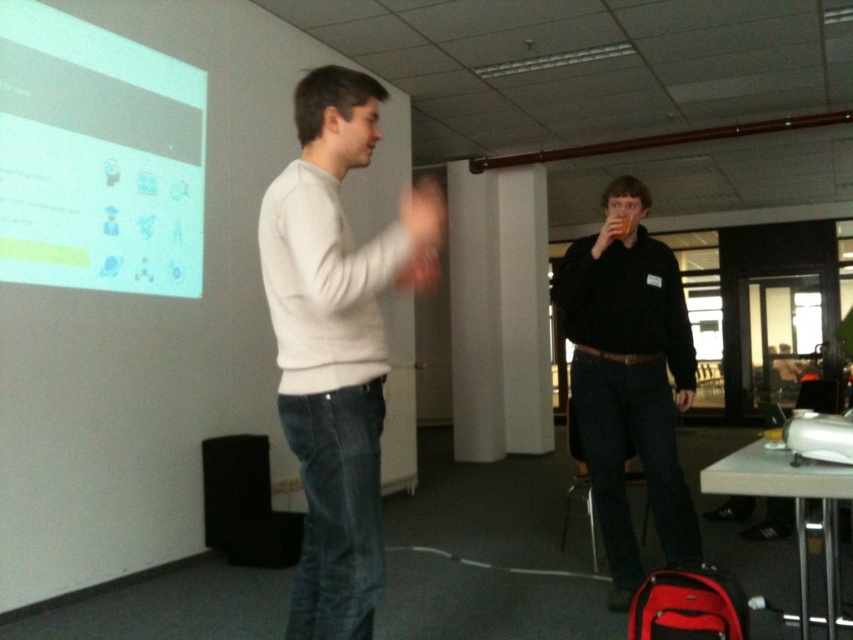
Does light gray sweater at center appear on the right side of white glossy projection screen at upper left?

Correct, you'll find light gray sweater at center to the right of white glossy projection screen at upper left.

Is point (291, 378) positioned after point (21, 144)?

No.

This screenshot has width=853, height=640. What are the coordinates of `light gray sweater at center` in the screenshot? It's located at (335, 342).

Between point (351, 429) and point (611, 205), which one is positioned behind?

Point (611, 205)

Can you confirm if light gray sweater at center is thinner than black matte shirt at center?

Indeed, light gray sweater at center has a lesser width compared to black matte shirt at center.

Image resolution: width=853 pixels, height=640 pixels. In order to click on light gray sweater at center in this screenshot , I will do `click(335, 342)`.

Is white glossy projection screen at upper left taller than black matte shirt at center?

In fact, white glossy projection screen at upper left may be shorter than black matte shirt at center.

Based on the photo, does white glossy projection screen at upper left appear under black matte shirt at center?

Incorrect, white glossy projection screen at upper left is not positioned below black matte shirt at center.

Between point (100, 188) and point (659, 477), which one is positioned behind?

The point (100, 188) is more distant.

The width and height of the screenshot is (853, 640). What are the coordinates of `white glossy projection screen at upper left` in the screenshot? It's located at (97, 157).